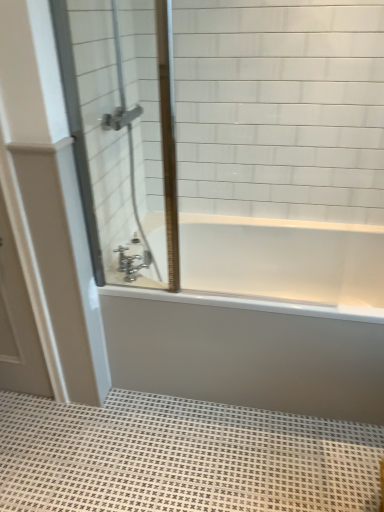
Question: Considering the positions of clear glass shower door at left and white textured bath mat at lower center in the image, is clear glass shower door at left taller or shorter than white textured bath mat at lower center?

Choices:
 (A) tall
 (B) short

Answer: (A)

Question: Is clear glass shower door at left bigger or smaller than white textured bath mat at lower center?

Choices:
 (A) big
 (B) small

Answer: (B)

Question: Based on their relative distances, which object is nearer to the white matte door at left?

Choices:
 (A) clear glass shower door at left
 (B) white textured bath mat at lower center
 (C) chrome metallic faucet at center
 (D) white glossy door at lower left
 (E) white glossy bathtub at center

Answer: (D)

Question: Which object is positioned closest to the clear glass shower door at left?

Choices:
 (A) white glossy door at lower left
 (B) chrome metallic faucet at center
 (C) white glossy bathtub at center
 (D) white matte door at left
 (E) white textured bath mat at lower center

Answer: (D)